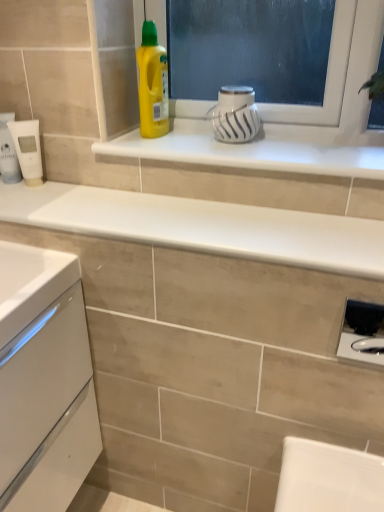
Locate an element on the screen. white glossy mug at upper center, the second appliance from the back is located at coordinates (235, 115).

Image resolution: width=384 pixels, height=512 pixels. Find the location of `white glossy shelf at upper center`. white glossy shelf at upper center is located at coordinates (259, 149).

Describe the element at coordinates (152, 84) in the screenshot. I see `yellow plastic bottle at upper center` at that location.

Based on the photo, measure the distance between yellow plastic bottle at upper center and camera.

The depth of yellow plastic bottle at upper center is 3.41 feet.

The width and height of the screenshot is (384, 512). What do you see at coordinates (362, 333) in the screenshot?
I see `satin black soap dispenser at lower right, the 3th appliance in the top-to-bottom sequence` at bounding box center [362, 333].

Where is `white matte tube at left`? The image size is (384, 512). white matte tube at left is located at coordinates (8, 152).

At what (x,y) coordinates should I click in order to perform the action: click on white glossy mug at upper center, which is the 2th appliance in left-to-right order. Please return your answer as a coordinate pair (x, y). Looking at the image, I should click on (235, 115).

Is point (339, 221) closer to viewer compared to point (152, 112)?

Yes, point (339, 221) is closer to viewer.

Is white glossy countertop at upper center to the right of yellow plastic bottle at upper center from the viewer's perspective?

Indeed, white glossy countertop at upper center is positioned on the right side of yellow plastic bottle at upper center.

Consider the image. From a real-world perspective, is white glossy countertop at upper center beneath yellow plastic bottle at upper center?

Yes, from a real-world perspective, white glossy countertop at upper center is beneath yellow plastic bottle at upper center.

Is yellow plastic bottle at upper center at the back of white glossy countertop at upper center?

white glossy countertop at upper center is not turned away from yellow plastic bottle at upper center.

Can we say satin black soap dispenser at lower right, the 3th appliance in the top-to-bottom sequence, lies outside white matte tube at left?

That's correct, satin black soap dispenser at lower right, the 3th appliance in the top-to-bottom sequence, is outside of white matte tube at left.

From a real-world perspective, is satin black soap dispenser at lower right, the first appliance from the front, physically located above or below white matte tube at left?

From a real-world perspective, satin black soap dispenser at lower right, the first appliance from the front, is physically below white matte tube at left.

From the image's perspective, between satin black soap dispenser at lower right, positioned as the third appliance in left-to-right order, and white matte tube at left, which one is located above?

white matte tube at left is shown above in the image.

Which is in front, satin black soap dispenser at lower right, the first appliance from the front, or white matte tube at left?

satin black soap dispenser at lower right, the first appliance from the front, is in front.

Which of these two, white matte tube at left or white matte tube at left, which is the 3th appliance from front to back, is thinner?

white matte tube at left, which is the 3th appliance from front to back, is thinner.

From a real-world perspective, which object stands above the other?

In real-world perspective, white matte tube at left is above.

Considering the sizes of objects white matte tube at left and white matte tube at left, the first appliance in the back-to-front sequence, in the image provided, who is smaller, white matte tube at left or white matte tube at left, the first appliance in the back-to-front sequence,?

With smaller size is white matte tube at left, the first appliance in the back-to-front sequence.

Would you say white matte tube at left is outside white matte tube at left, the third appliance viewed from the right?

white matte tube at left is positioned outside white matte tube at left, the third appliance viewed from the right.

Considering the sizes of objects yellow plastic bottle at upper center and white glossy mug at upper center, the second appliance from the back, in the image provided, who is bigger, yellow plastic bottle at upper center or white glossy mug at upper center, the second appliance from the back,?

Bigger between the two is yellow plastic bottle at upper center.

From a real-world perspective, which object stands above the other?

yellow plastic bottle at upper center.

Is yellow plastic bottle at upper center not near white glossy mug at upper center, marked as the second appliance in a front-to-back arrangement?

They are positioned close to each other.

Considering the sizes of objects yellow plastic bottle at upper center and white matte tube at left in the image provided, who is taller, yellow plastic bottle at upper center or white matte tube at left?

With more height is yellow plastic bottle at upper center.

Between yellow plastic bottle at upper center and white matte tube at left, which one has larger size?

Bigger between the two is yellow plastic bottle at upper center.

Is white matte tube at left at the back of yellow plastic bottle at upper center?

yellow plastic bottle at upper center is not turned away from white matte tube at left.

Considering the sizes of objects white matte tube at left, which is the 3th appliance from front to back, and white glossy shelf at upper center in the image provided, who is thinner, white matte tube at left, which is the 3th appliance from front to back, or white glossy shelf at upper center?

With smaller width is white matte tube at left, which is the 3th appliance from front to back.

How many degrees apart are the facing directions of white matte tube at left, which is the 3th appliance from front to back, and white glossy shelf at upper center?

37.1 degrees.

Between white matte tube at left, which is the 3th appliance from front to back, and white glossy shelf at upper center, which one appears on the right side from the viewer's perspective?

Positioned to the right is white glossy shelf at upper center.

Can we say white matte tube at left, acting as the second appliance starting from the bottom, lies outside white glossy shelf at upper center?

Yes, white matte tube at left, acting as the second appliance starting from the bottom, is located beyond the bounds of white glossy shelf at upper center.

Which is closer, (33, 136) or (248, 124)?

The point (248, 124) is closer to the camera.

From a real-world perspective, which object stands above the other?

white glossy mug at upper center, the second appliance from the back, is physically above.

Is white matte tube at left, the first appliance in the back-to-front sequence, at the right side of white glossy mug at upper center, which is the 2th appliance in left-to-right order?

No.

Locate an element on the screen. The width and height of the screenshot is (384, 512). cleaning product behind the white glossy countertop at upper center is located at coordinates (152, 84).

Where is `the 2nd appliance located beneath the white matte tube at left (from a real-world perspective)`? the 2nd appliance located beneath the white matte tube at left (from a real-world perspective) is located at coordinates (362, 333).

Which object lies further to the anchor point white glossy countertop at upper center, yellow plastic bottle at upper center or satin black soap dispenser at lower right, the 3th appliance in the top-to-bottom sequence?

satin black soap dispenser at lower right, the 3th appliance in the top-to-bottom sequence, is further to white glossy countertop at upper center.

Considering their positions, is white glossy mug at upper center, marked as the second appliance in a front-to-back arrangement, positioned closer to white glossy countertop at upper center than yellow plastic bottle at upper center?

Among the two, white glossy mug at upper center, marked as the second appliance in a front-to-back arrangement, is located nearer to white glossy countertop at upper center.

Estimate the real-world distances between objects in this image. Which object is closer to yellow plastic bottle at upper center, satin black soap dispenser at lower right, the first appliance from the front, or white glossy countertop at upper center?

Based on the image, white glossy countertop at upper center appears to be nearer to yellow plastic bottle at upper center.

Considering their positions, is white glossy mug at upper center, marked as the second appliance in a front-to-back arrangement, positioned further to white glossy shelf at upper center than white matte tube at left, which is the 3th appliance from front to back?

white matte tube at left, which is the 3th appliance from front to back, is further to white glossy shelf at upper center.

When comparing their distances from white glossy mug at upper center, which is the 2th appliance in left-to-right order, does satin black soap dispenser at lower right, which is the 1th appliance from bottom to top, or white matte tube at left seem closer?

The object closer to white glossy mug at upper center, which is the 2th appliance in left-to-right order, is white matte tube at left.

Estimate the real-world distances between objects in this image. Which object is further from yellow plastic bottle at upper center, white glossy shelf at upper center or white glossy mug at upper center, the 1th appliance from the top?

Among the two, white glossy shelf at upper center is located further to yellow plastic bottle at upper center.

Considering their positions, is white matte tube at left positioned further to white glossy countertop at upper center than white glossy shelf at upper center?

The object further to white glossy countertop at upper center is white matte tube at left.

Estimate the real-world distances between objects in this image. Which object is further from yellow plastic bottle at upper center, white glossy mug at upper center, the 1th appliance from the top, or white glossy shelf at upper center?

Among the two, white glossy shelf at upper center is located further to yellow plastic bottle at upper center.

Where is `cleaning product located between white matte tube at left and white glossy countertop at upper center in the left-right direction`? The width and height of the screenshot is (384, 512). cleaning product located between white matte tube at left and white glossy countertop at upper center in the left-right direction is located at coordinates (152, 84).

What are the coordinates of `window sill situated between white matte tube at left, which is the 3th appliance from front to back, and satin black soap dispenser at lower right, the 3th appliance in the top-to-bottom sequence, from left to right` in the screenshot? It's located at (259, 149).

Find the location of a particular element. The height and width of the screenshot is (512, 384). appliance between white matte tube at left and white glossy countertop at upper center from left to right is located at coordinates (28, 150).

The image size is (384, 512). What are the coordinates of `countertop located between white matte tube at left, acting as the second appliance starting from the bottom, and white glossy shelf at upper center in the left-right direction` in the screenshot? It's located at (202, 226).